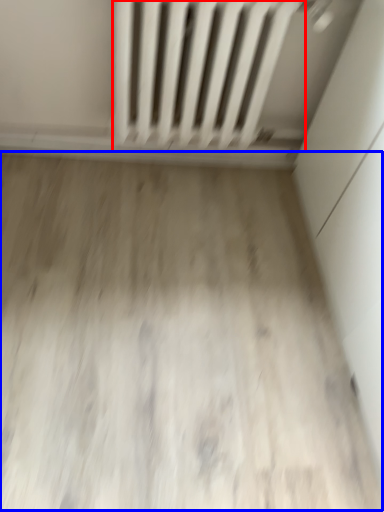
Question: Among these objects, which one is farthest to the camera, radiator (highlighted by a red box) or plain (highlighted by a blue box)?

Choices:
 (A) radiator
 (B) plain

Answer: (A)